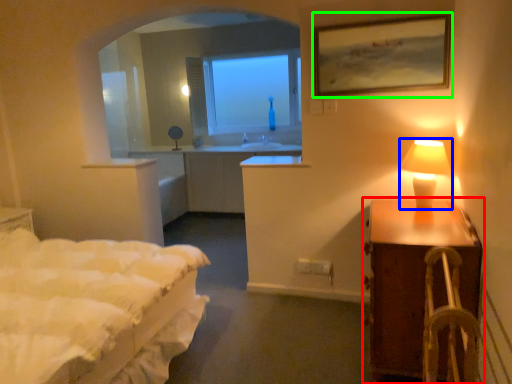
Question: Considering the real-world distances, which object is closest to nightstand (highlighted by a red box)? table lamp (highlighted by a blue box) or picture frame (highlighted by a green box).

Choices:
 (A) table lamp
 (B) picture frame

Answer: (A)